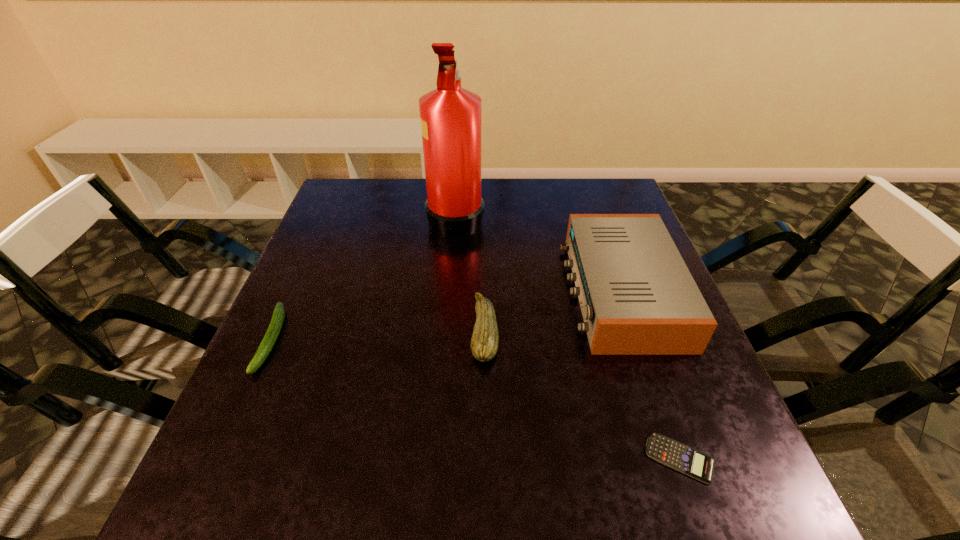
The height and width of the screenshot is (540, 960). I want to click on empty space between the right zucchini and the tallest object, so click(x=470, y=273).

Where is `free space between the radio receiver and the fourth tallest object`? Image resolution: width=960 pixels, height=540 pixels. free space between the radio receiver and the fourth tallest object is located at coordinates (446, 315).

The width and height of the screenshot is (960, 540). In order to click on unoccupied area between the nearest object and the third shortest object in this screenshot , I will do `click(582, 394)`.

Image resolution: width=960 pixels, height=540 pixels. I want to click on unoccupied area between the calculator and the left zucchini, so tap(476, 399).

Locate an element on the screen. The height and width of the screenshot is (540, 960). vacant area between the fourth tallest object and the calculator is located at coordinates 476,399.

The width and height of the screenshot is (960, 540). I want to click on free space between the shortest object and the fourth tallest object, so click(x=476, y=399).

Find the location of a particular element. The width and height of the screenshot is (960, 540). vacant region between the right zucchini and the second tallest object is located at coordinates coord(553,310).

You are a GUI agent. You are given a task and a screenshot of the screen. Output one action in this format:
    pyautogui.click(x=<x>, y=<y>)
    Task: Click on the vacant area between the third shortest object and the fourth tallest object
    
    Given the screenshot: What is the action you would take?
    pyautogui.click(x=378, y=335)

Select which object appears as the closest to the nearest object. Please provide its 2D coordinates. Your answer should be formatted as a tuple, i.e. [(x, y)], where the tuple contains the x and y coordinates of a point satisfying the conditions above.

[(637, 297)]

Where is `object that is the second closest one to the second shortest object`? object that is the second closest one to the second shortest object is located at coordinates (484, 344).